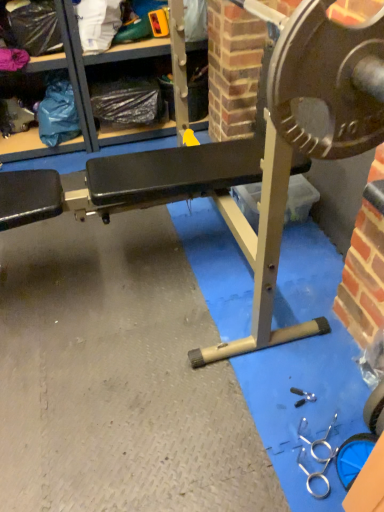
Describe the element at coordinates (240, 159) in the screenshot. I see `metallic black bench at center` at that location.

The image size is (384, 512). Find the location of `metallic black bench at center`. metallic black bench at center is located at coordinates (240, 159).

In order to face metallic gray shelf at upper center, should I rotate leftwards or rightwards?

To align with it, rotate left about 5.503°.

Identify the location of metallic gray shelf at upper center. (86, 102).

Measure the distance between metallic gray shelf at upper center and camera.

They are 6.87 feet apart.

This screenshot has height=512, width=384. Describe the element at coordinates (86, 102) in the screenshot. I see `metallic gray shelf at upper center` at that location.

In order to click on metallic black bench at center in this screenshot , I will do `click(240, 159)`.

Is metallic gray shelf at upper center at the left side of metallic black bench at center?

Yes.

Which is behind, metallic gray shelf at upper center or metallic black bench at center?

metallic gray shelf at upper center.

Does point (43, 69) come in front of point (256, 141)?

That is False.

From the image's perspective, does metallic gray shelf at upper center appear higher than metallic black bench at center?

Yes.

From a real-world perspective, is metallic gray shelf at upper center above or below metallic black bench at center?

metallic gray shelf at upper center is situated lower than metallic black bench at center in the real world.

Considering the sizes of objects metallic gray shelf at upper center and metallic black bench at center in the image provided, who is thinner, metallic gray shelf at upper center or metallic black bench at center?

With smaller width is metallic black bench at center.

Which of these two, metallic gray shelf at upper center or metallic black bench at center, stands taller?

With more height is metallic gray shelf at upper center.

Considering the relative sizes of metallic gray shelf at upper center and metallic black bench at center in the image provided, is metallic gray shelf at upper center smaller than metallic black bench at center?

No.

Is metallic gray shelf at upper center positioned beyond the bounds of metallic black bench at center?

Yes, metallic gray shelf at upper center is located beyond the bounds of metallic black bench at center.

Are metallic gray shelf at upper center and metallic black bench at center far apart?

Indeed, metallic gray shelf at upper center is not near metallic black bench at center.

Is metallic gray shelf at upper center aimed at metallic black bench at center?

Yes.

How distant is metallic gray shelf at upper center from metallic black bench at center?

metallic gray shelf at upper center and metallic black bench at center are 1.24 meters apart from each other.

In order to click on bench below the metallic gray shelf at upper center (from the image's perspective) in this screenshot , I will do `click(240, 159)`.

Would you say metallic black bench at center is to the left or to the right of metallic gray shelf at upper center in the picture?

metallic black bench at center is to the right of metallic gray shelf at upper center.

Which object is further away from the camera, metallic black bench at center or metallic gray shelf at upper center?

metallic gray shelf at upper center is more distant.

Is point (266, 186) closer or farther from the camera than point (21, 155)?

Point (266, 186).

From the image's perspective, which one is positioned higher, metallic black bench at center or metallic gray shelf at upper center?

From the image's view, metallic gray shelf at upper center is above.

From a real-world perspective, relative to metallic gray shelf at upper center, is metallic black bench at center vertically above or below?

Clearly, from a real-world perspective, metallic black bench at center is above metallic gray shelf at upper center.

Looking at their sizes, would you say metallic black bench at center is wider or thinner than metallic gray shelf at upper center?

metallic black bench at center is thinner than metallic gray shelf at upper center.

Based on the photo, between metallic black bench at center and metallic gray shelf at upper center, which one has less height?

With less height is metallic black bench at center.

Is metallic black bench at center bigger than metallic gray shelf at upper center?

No, metallic black bench at center is not bigger than metallic gray shelf at upper center.

Based on the photo, would you say metallic black bench at center contains metallic gray shelf at upper center?

No.

Is metallic black bench at center not close to metallic gray shelf at upper center?

Yes, metallic black bench at center is far from metallic gray shelf at upper center.

Is metallic black bench at center aimed at metallic gray shelf at upper center?

No, metallic black bench at center does not turn towards metallic gray shelf at upper center.

What's the angular difference between metallic black bench at center and metallic gray shelf at upper center's facing directions?

The angular difference between metallic black bench at center and metallic gray shelf at upper center is 88.6 degrees.

I want to click on shelf behind the metallic black bench at center, so click(x=86, y=102).

You are a GUI agent. You are given a task and a screenshot of the screen. Output one action in this format:
    pyautogui.click(x=<x>, y=<y>)
    Task: Click on the shelf on the left of metallic black bench at center
    This screenshot has width=384, height=512.
    Given the screenshot: What is the action you would take?
    pyautogui.click(x=86, y=102)

Image resolution: width=384 pixels, height=512 pixels. In the image, there is a metallic gray shelf at upper center. In order to click on bench below it (from the image's perspective) in this screenshot , I will do `click(240, 159)`.